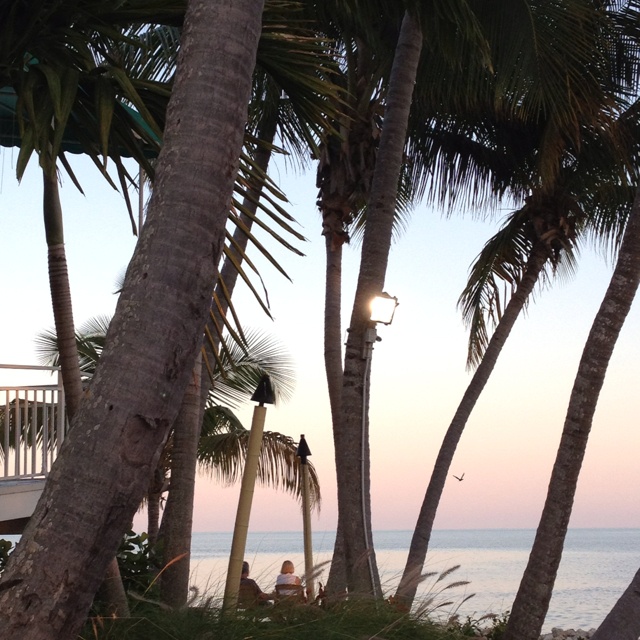
Locate an element on the screen. The height and width of the screenshot is (640, 640). chair is located at coordinates (283, 596), (241, 594).